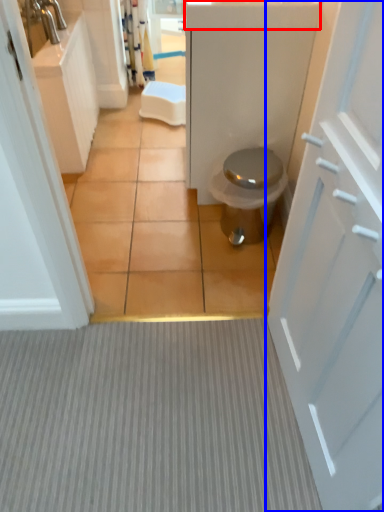
Question: Which object appears closest to the camera in this image, counter top (highlighted by a red box) or door (highlighted by a blue box)?

Choices:
 (A) counter top
 (B) door

Answer: (B)